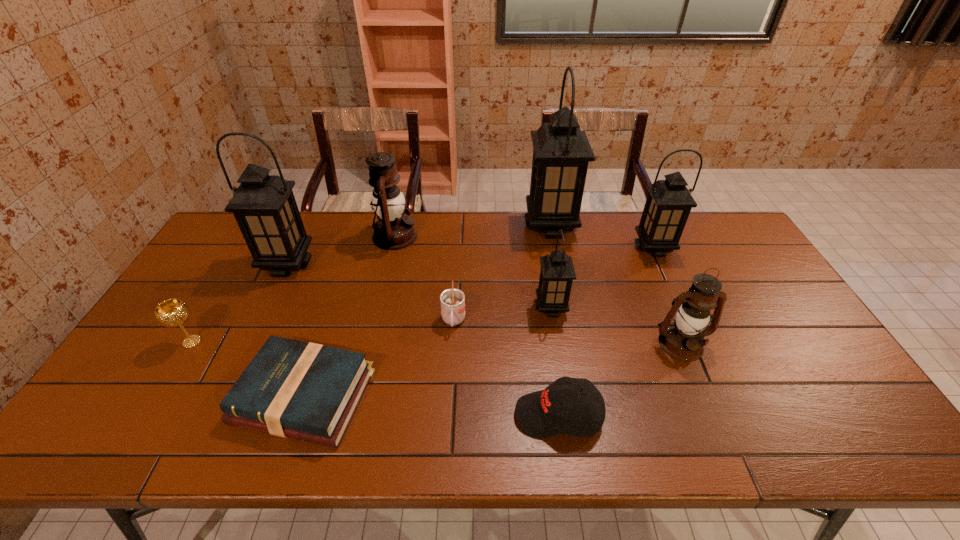
Locate an element on the screen. The width and height of the screenshot is (960, 540). free spot located on the left of the third biggest black lantern is located at coordinates (620, 248).

Where is `vacant area situated 0.260m on the front of the nearest black lantern`? Image resolution: width=960 pixels, height=540 pixels. vacant area situated 0.260m on the front of the nearest black lantern is located at coordinates (566, 401).

I want to click on vacant space situated 0.050m on the side of the smaller brown lantern, there is a wick adjustment knob, so click(x=695, y=378).

I want to click on vacant position located 0.060m on the front of the fourth shortest object, so click(174, 372).

At what (x,y) coordinates should I click in order to perform the action: click on vacant space situated on the side with the handle of the cup. Please return your answer as a coordinate pair (x, y). Image resolution: width=960 pixels, height=540 pixels. Looking at the image, I should click on (451, 354).

I want to click on vacant space located 0.400m on the front-facing side of the baseball cap, so click(x=345, y=415).

Where is `free space located 0.150m on the front-facing side of the baseball cap`? The image size is (960, 540). free space located 0.150m on the front-facing side of the baseball cap is located at coordinates (451, 415).

You are a GUI agent. You are given a task and a screenshot of the screen. Output one action in this format:
    pyautogui.click(x=<x>, y=<y>)
    Task: Click on the vacant point located 0.370m on the front-facing side of the baseball cap
    
    Given the screenshot: What is the action you would take?
    pyautogui.click(x=357, y=415)

The image size is (960, 540). Find the location of `free location located on the right of the hardback book`. free location located on the right of the hardback book is located at coordinates (440, 396).

I want to click on baseball cap located at the near edge, so (x=540, y=414).